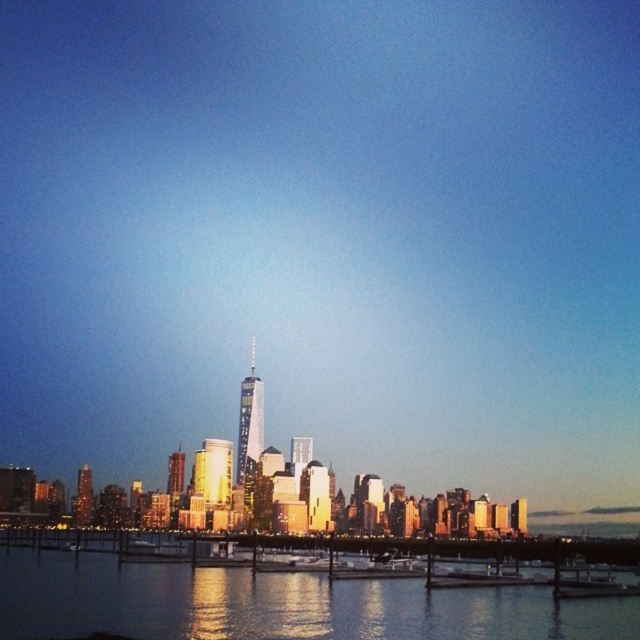
Does glistening water at lower center appear under shiny glass skyscraper at center?

Yes, glistening water at lower center is below shiny glass skyscraper at center.

Which is more to the left, glistening water at lower center or shiny glass skyscraper at center?

shiny glass skyscraper at center

Which is in front, point (44, 580) or point (241, 456)?

Point (44, 580)

You are a GUI agent. You are given a task and a screenshot of the screen. Output one action in this format:
    pyautogui.click(x=<x>, y=<y>)
    Task: Click on the glistening water at lower center
    This screenshot has width=640, height=640.
    Given the screenshot: What is the action you would take?
    pyautogui.click(x=278, y=604)